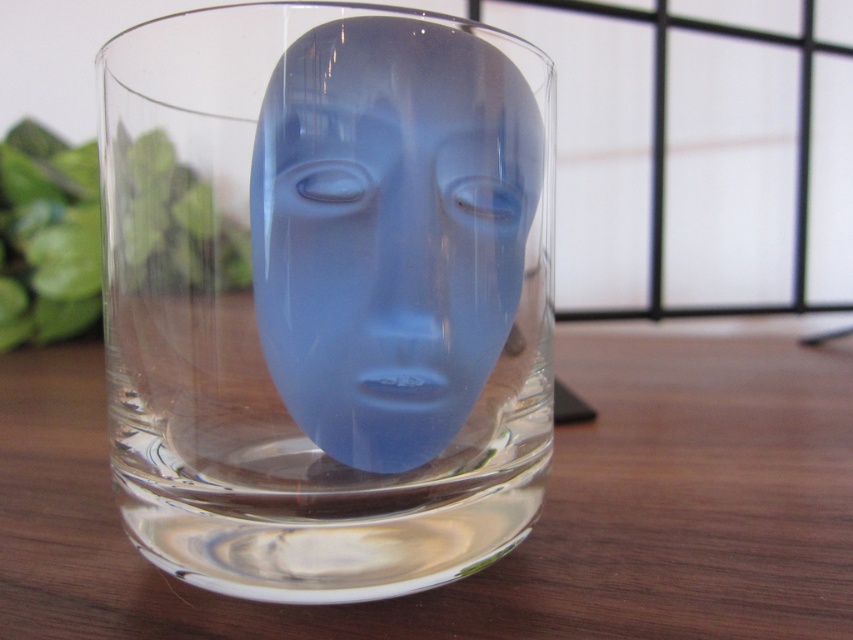
You are looking at the image and notice two points marked in it. The first point is at coordinate point(x=331, y=182) and the second is at point(x=654, y=419). Which of these two points is closer to you?

Point(x=331, y=182) is closer to the viewer than point(x=654, y=419).